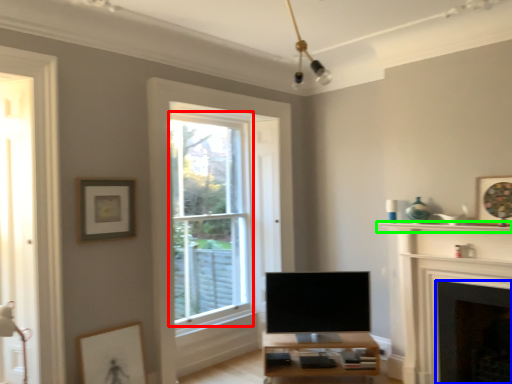
Question: Which object is the closest to the bay window (highlighted by a red box)? Choose among these: fireplace (highlighted by a blue box) or shelf (highlighted by a green box).

Choices:
 (A) fireplace
 (B) shelf

Answer: (B)